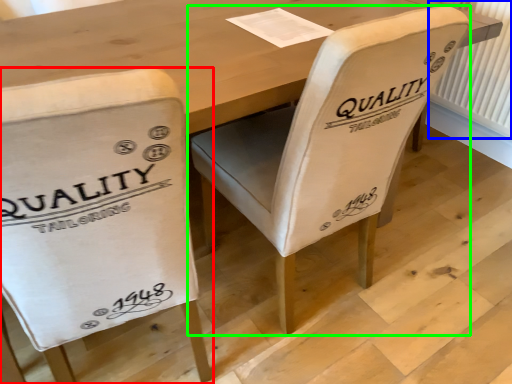
Question: Which object is positioned closest to chair (highlighted by a red box)? Select from radiator (highlighted by a blue box) and chair (highlighted by a green box).

Choices:
 (A) radiator
 (B) chair

Answer: (B)